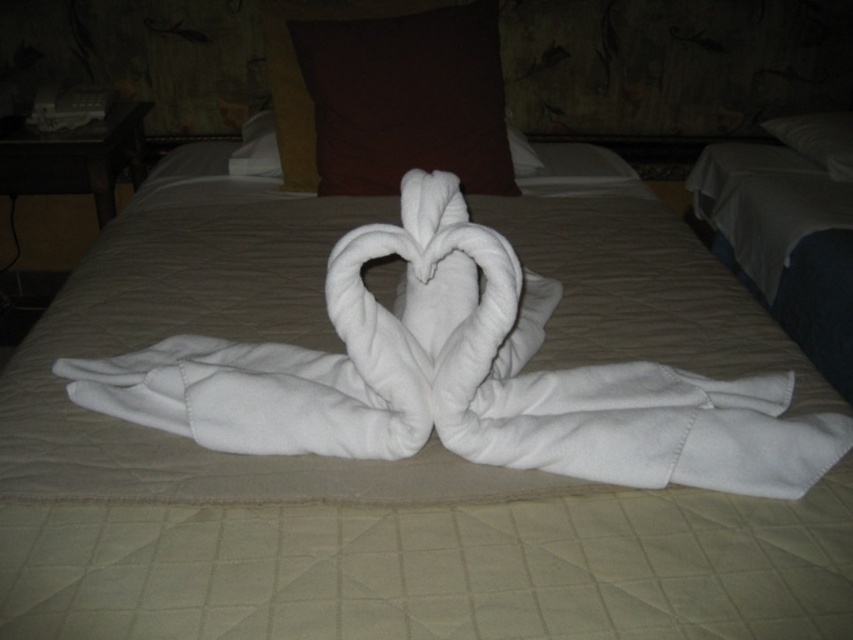
Which is above, white towel at center or white soft pillow at upper center?

Positioned higher is white soft pillow at upper center.

Does white towel at center appear under white soft pillow at upper center?

Indeed, white towel at center is positioned under white soft pillow at upper center.

Is point (207, 420) closer to viewer compared to point (846, 161)?

Yes, point (207, 420) is closer to viewer.

Where is `white towel at center`? The width and height of the screenshot is (853, 640). white towel at center is located at coordinates (462, 378).

Which of these two, white towel at center or brown fabric pillow at upper center, stands shorter?

white towel at center is shorter.

Which is below, white towel at center or brown fabric pillow at upper center?

white towel at center

The height and width of the screenshot is (640, 853). Find the location of `white towel at center`. white towel at center is located at coordinates point(462,378).

Find the location of `white towel at center`. white towel at center is located at coordinates (462, 378).

Locate an element on the screen. The image size is (853, 640). brown fabric pillow at upper center is located at coordinates (405, 99).

Does brown fabric pillow at upper center appear under white soft pillow at upper center?

Yes.

Is point (477, 26) less distant than point (788, 140)?

Yes, point (477, 26) is in front of point (788, 140).

Identify the location of brown fabric pillow at upper center. (405, 99).